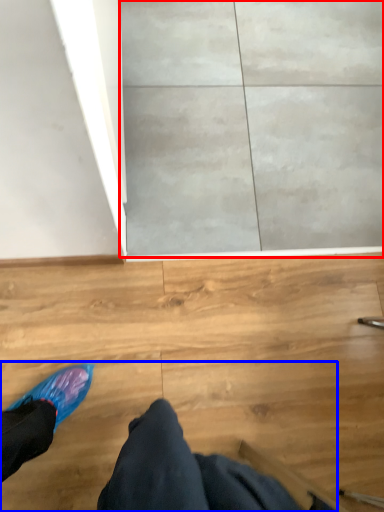
Question: Which of the following is the closest to the observer, concrete (highlighted by a red box) or person (highlighted by a blue box)?

Choices:
 (A) concrete
 (B) person

Answer: (B)